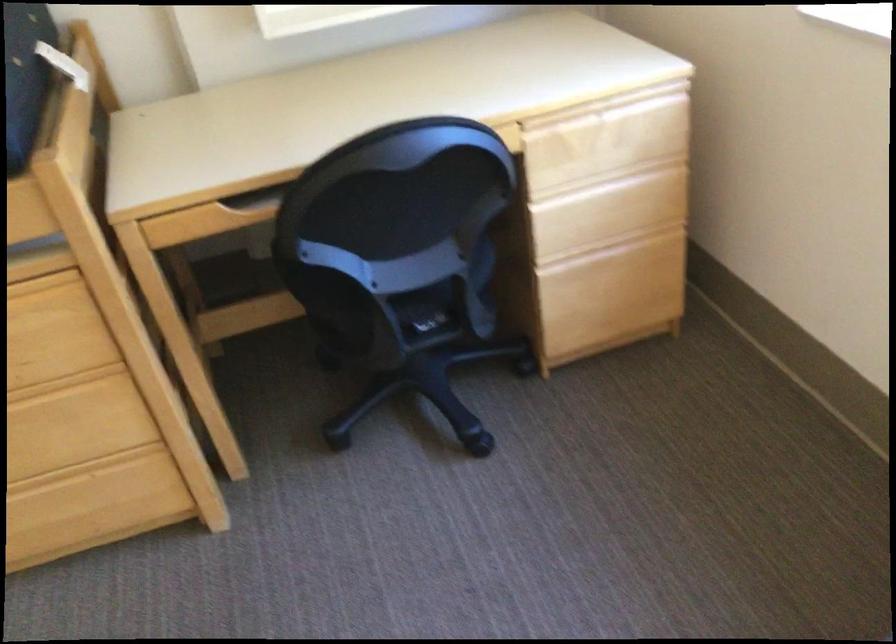
Where is `chair sitting surface`? chair sitting surface is located at coordinates coord(401,328).